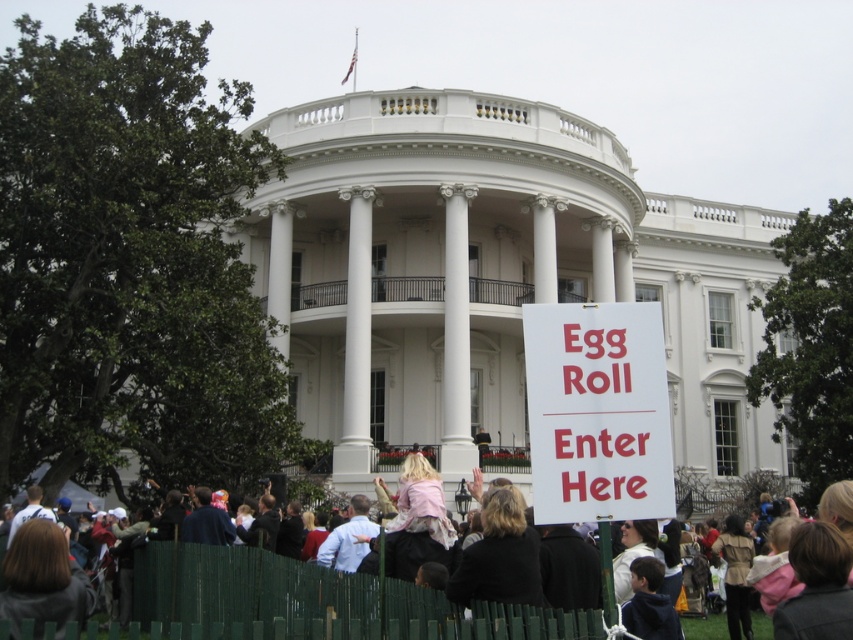
Does white paper sign at center have a lesser height compared to blonde hair at center?

No, white paper sign at center is not shorter than blonde hair at center.

Can you confirm if white paper sign at center is positioned above blonde hair at center?

Yes, white paper sign at center is above blonde hair at center.

Which is in front, point (654, 502) or point (383, 608)?

Point (654, 502) is more forward.

Find the location of a particular element. The width and height of the screenshot is (853, 640). white paper sign at center is located at coordinates (596, 412).

Is point (392, 608) farther from viewer compared to point (135, 550)?

That is False.

Does point (408, 634) come farther from viewer compared to point (405, 620)?

No, (408, 634) is closer to viewer.

Identify the location of blonde hair at center. (312, 602).

Is white paper sign at center wider than green wooden fence at lower center?

No.

Is point (618, 385) closer to viewer compared to point (379, 588)?

Yes, point (618, 385) is in front of point (379, 588).

Locate an element on the screen. The image size is (853, 640). white paper sign at center is located at coordinates (596, 412).